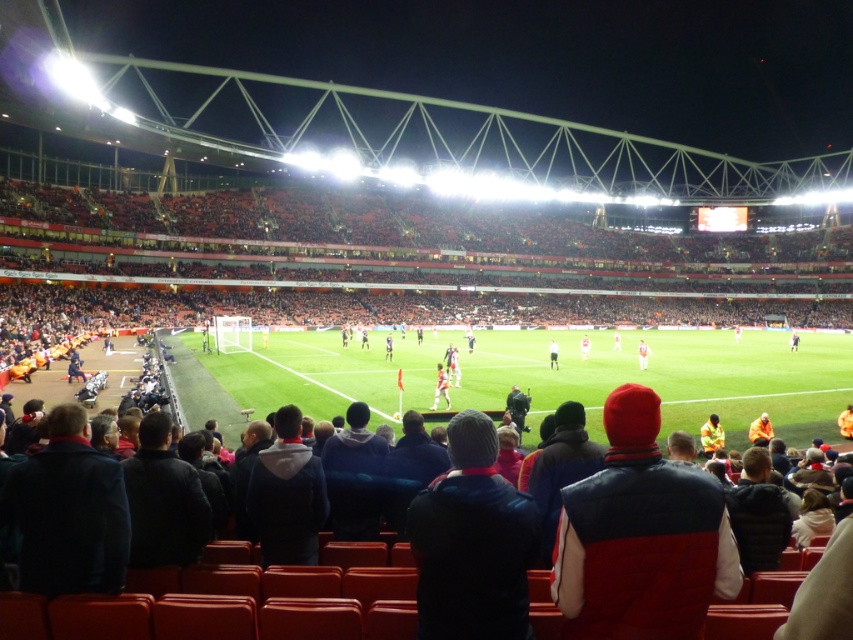
You are a photographer standing at the edge of the field. You want to take a photo that includes both the orange jersey at center and the white fabric shirt at center. Based on their positions, which player should be placed closer to the camera to ensure both are fully visible in the frame?

The orange jersey at center might be wider than white fabric shirt at center, so to ensure both are fully visible in the frame, the orange jersey at center should be placed closer to the camera.

You are a drone operator trying to capture aerial footage of the football match. The stadium has a restricted airspace zone at point (556, 376). You need to fly your drone to film the green grass football field at center without entering the restricted zone. Can you do it?

The green grass football field at center is located at point (556, 376), so the restricted airspace zone is exactly where the field is. Therefore, you cannot film the field without entering the restricted zone.